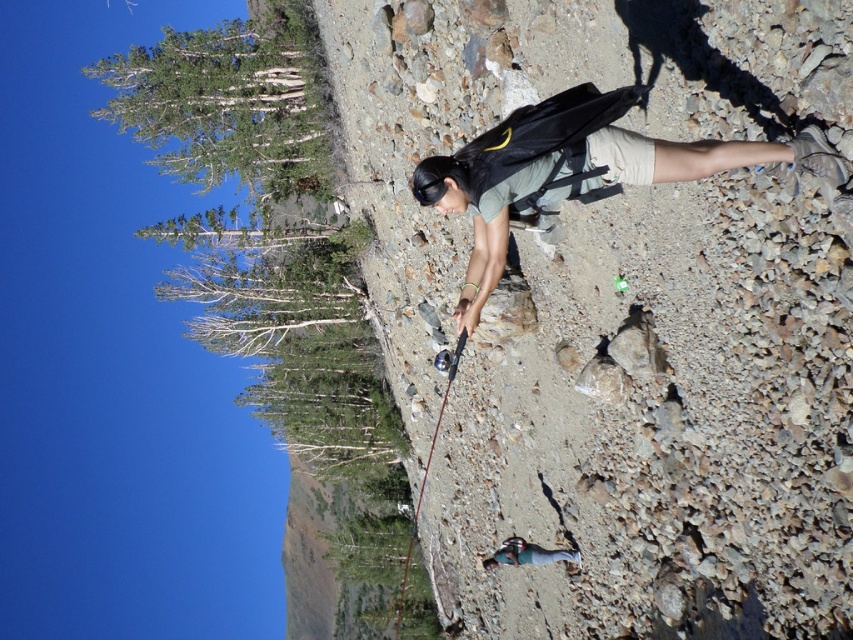
You are a hiker trying to locate the brown rocky cliff at center. Based on the coordinates provided, where would you find it in the image?

The brown rocky cliff at center is located at coordinates point (659,419) in the image.

You are a hiker who wants to place your matte gray backpack at center on top of the brown rocky cliff at center. Can you do that?

The brown rocky cliff at center is taller than matte gray backpack at center, so you can place the matte gray backpack at center on top of the brown rocky cliff at center since the cliff is higher.